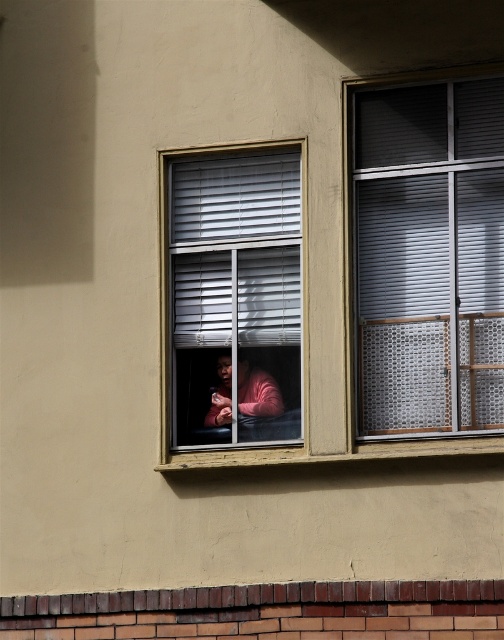
You are standing outside the building and want to see the pink matte sweater at center through the matte plastic window at center. Can you see it clearly?

The matte plastic window at center is in front of the pink matte sweater at center, so yes, you can see the pink matte sweater at center through the matte plastic window at center as it is directly in front of it.

What are the coordinates of the matte plastic window at center in the image?

The coordinates of the matte plastic window at center are at point [232,296].